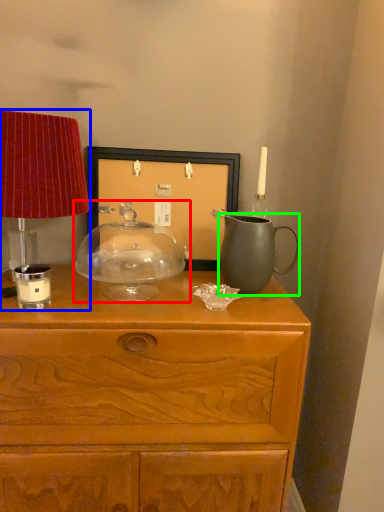
Question: Considering the real-world distances, which object is closest to candle holder (highlighted by a red box)? table lamp (highlighted by a blue box) or jug (highlighted by a green box).

Choices:
 (A) table lamp
 (B) jug

Answer: (A)